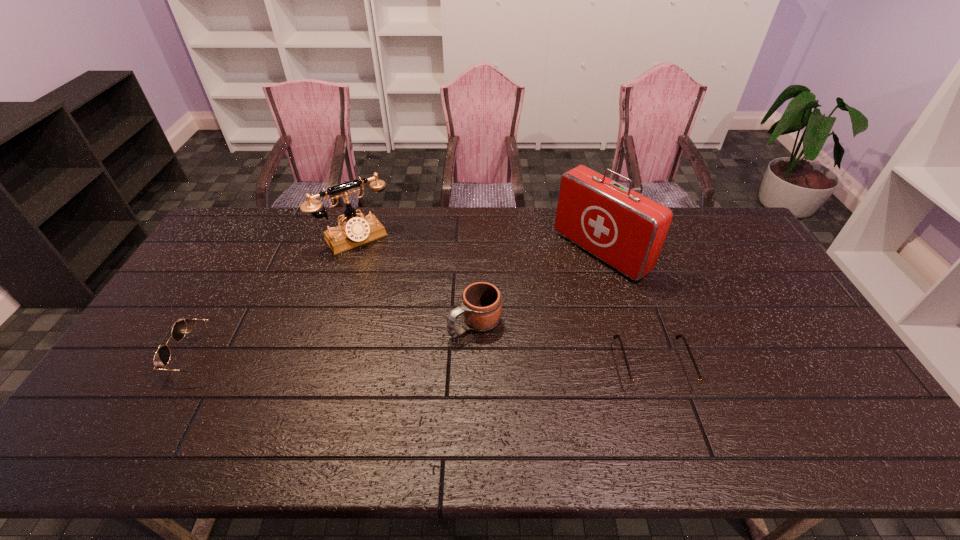
Locate an element on the screen. the leftmost object is located at coordinates (161, 359).

This screenshot has width=960, height=540. What are the coordinates of `sunglasses` in the screenshot? It's located at (161, 359).

At what (x,y) coordinates should I click in order to perform the action: click on spectacles. Please return your answer as a coordinate pair (x, y). Looking at the image, I should click on (x=642, y=386).

Where is `the tallest object`? The image size is (960, 540). the tallest object is located at coordinates (625, 229).

Where is `the third tallest object`? The height and width of the screenshot is (540, 960). the third tallest object is located at coordinates (481, 303).

Locate an element on the screen. The height and width of the screenshot is (540, 960). mug is located at coordinates (481, 303).

Locate an element on the screen. telephone is located at coordinates (355, 231).

Identify the location of the fourth object from right to left. (355, 231).

In order to click on vacant space located 0.090m on the front lenses of the second shortest object in this screenshot , I will do `click(147, 355)`.

At what (x,y) coordinates should I click in order to perform the action: click on vacant point located 0.120m on the front lenses of the second shortest object. Please return your answer as a coordinate pair (x, y). This screenshot has width=960, height=540. Looking at the image, I should click on (135, 355).